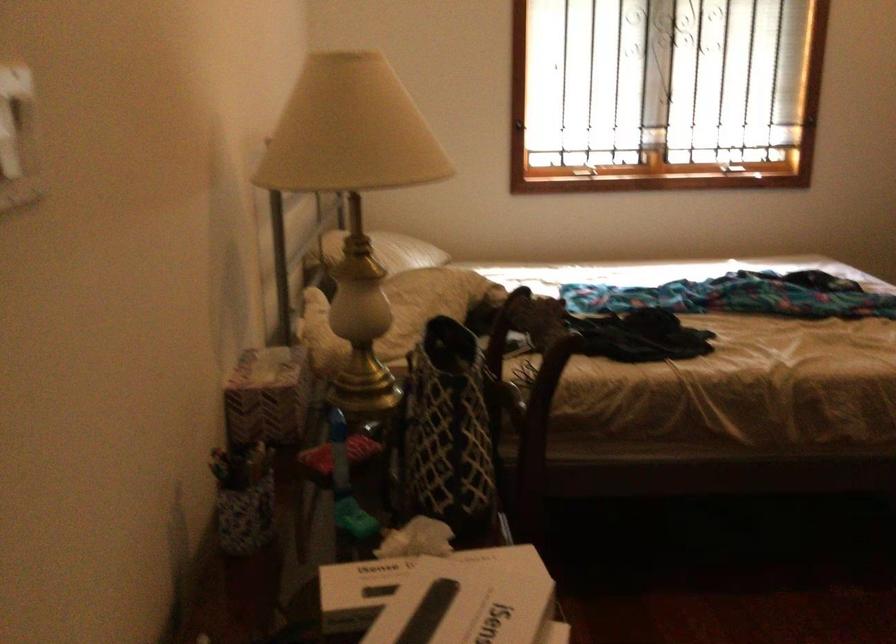
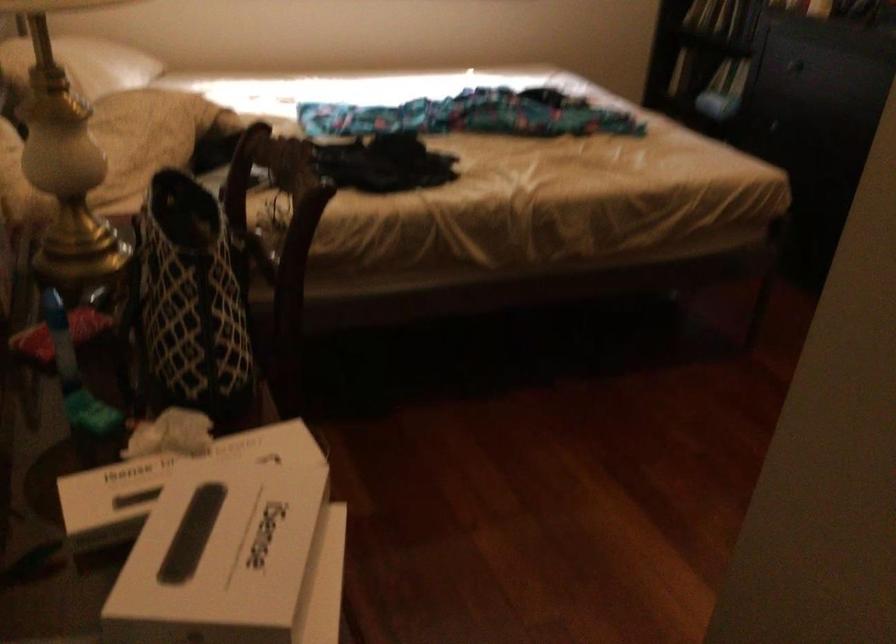
Question: In a continuous first-person perspective shot, in which direction is the camera moving?

Choices:
 (A) Left
 (B) Right
 (C) Forward
 (D) Backward

Answer: (C)